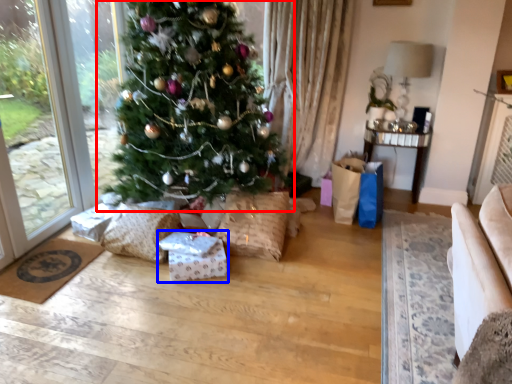
Question: Which of the following is the closest to the observer, christmas tree (highlighted by a red box) or package (highlighted by a blue box)?

Choices:
 (A) christmas tree
 (B) package

Answer: (A)